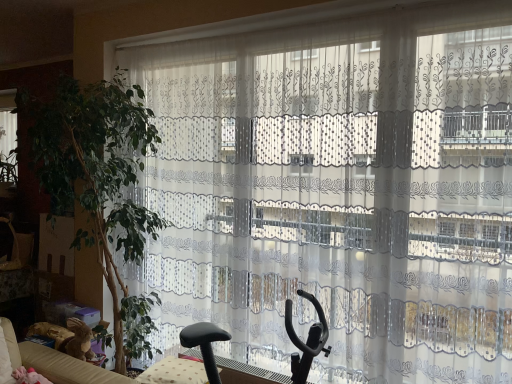
Question: Based on their positions, is black plastic swivel chair at center located to the left or right of green leafy plant at left?

Choices:
 (A) left
 (B) right

Answer: (B)

Question: Do you think black plastic swivel chair at center is within green leafy plant at left, or outside of it?

Choices:
 (A) inside
 (B) outside

Answer: (B)

Question: Which object is the closest to the transparent lace curtain at left?

Choices:
 (A) green leafy plant at left
 (B) black plastic swivel chair at center

Answer: (A)

Question: Which of these objects is positioned closest to the green leafy plant at left?

Choices:
 (A) black plastic swivel chair at center
 (B) transparent lace curtain at left

Answer: (A)